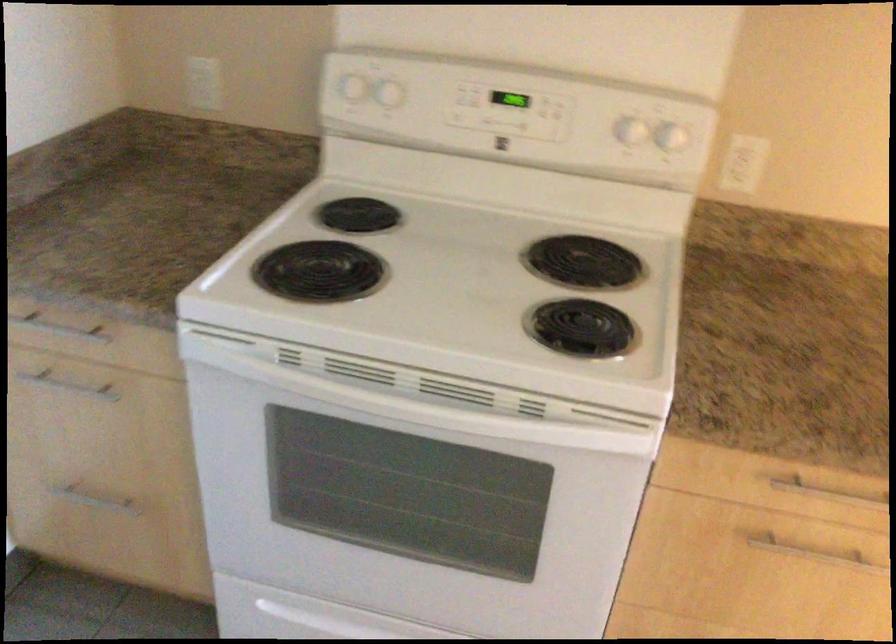
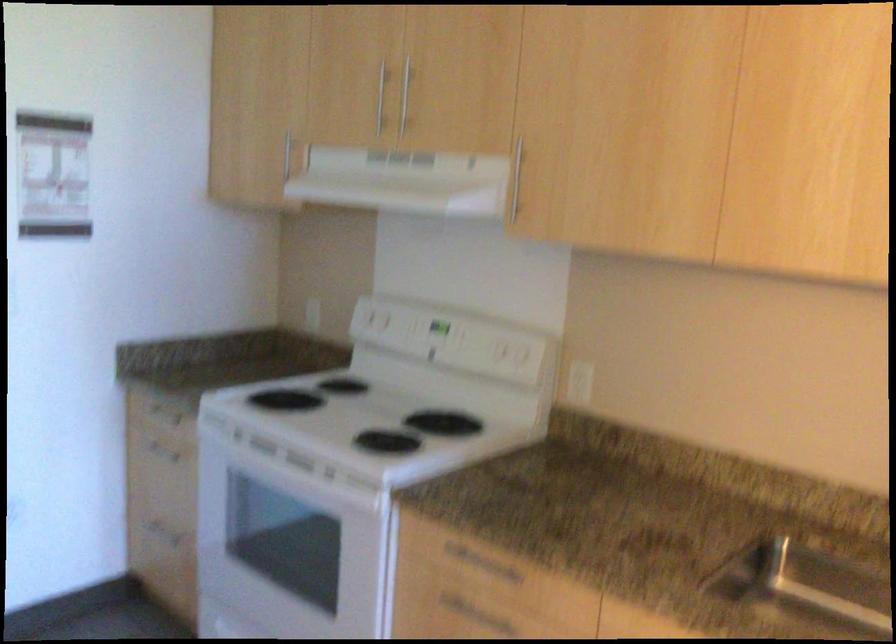
Locate, in the second image, the point that corresponds to pixel 633 512 in the first image.

(385, 571)